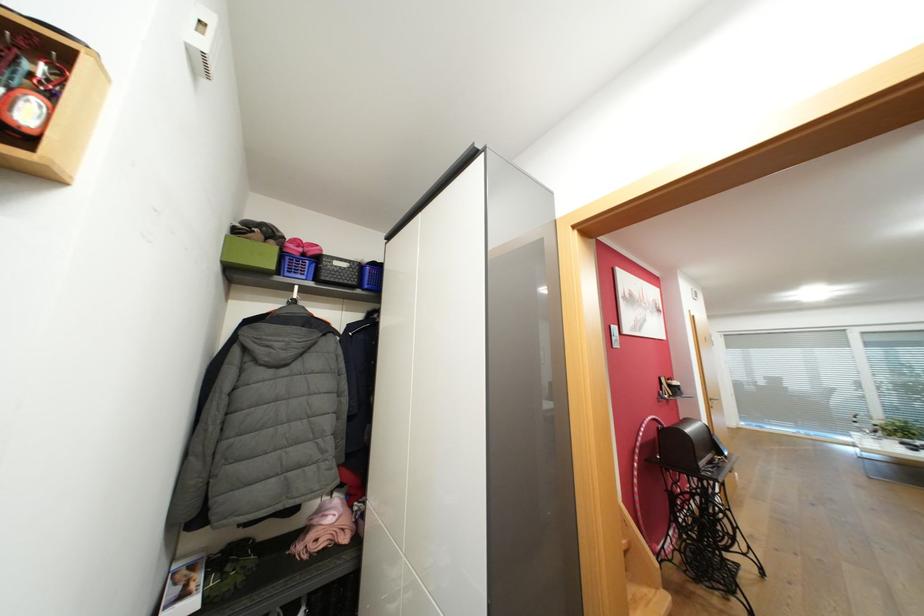
Find the location of a particular element. This screenshot has width=924, height=616. red and white hula-hoop is located at coordinates (643, 480).